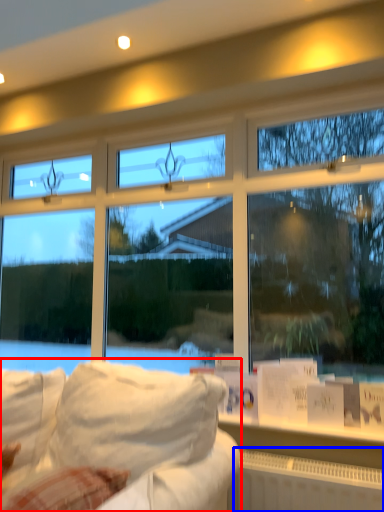
Question: Which point is closer to the camera, studio couch (highlighted by a red box) or radiator (highlighted by a blue box)?

Choices:
 (A) studio couch
 (B) radiator

Answer: (A)